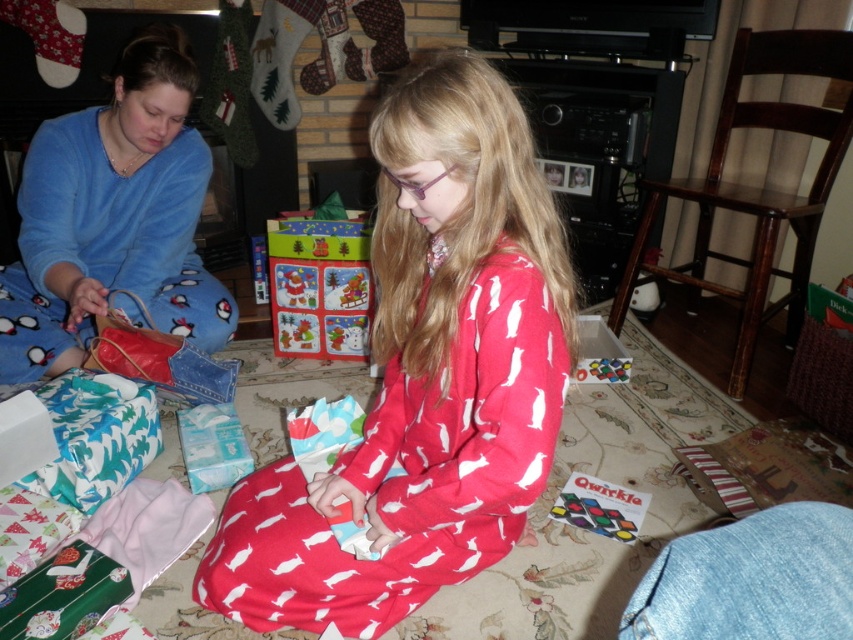
Question: Can you confirm if faded denim jacket at lower right is wider than christmas-themed paper gift at center?

Choices:
 (A) no
 (B) yes

Answer: (A)

Question: Which object appears farthest from the camera in this image?

Choices:
 (A) faded denim jacket at lower right
 (B) blue fleece pajamas at left

Answer: (B)

Question: In this image, where is red flannel pajamas at center located relative to blue fleece pajamas at left?

Choices:
 (A) left
 (B) right

Answer: (B)

Question: Which of the following is the closest to the observer?

Choices:
 (A) (83, 179)
 (B) (379, 454)
 (C) (732, 547)
 (D) (277, 269)

Answer: (C)

Question: Which point is closer to the camera taking this photo?

Choices:
 (A) (329, 209)
 (B) (444, 528)
 (C) (152, 65)

Answer: (B)

Question: Is red flannel pajamas at center bigger than christmas-themed paper gift at center?

Choices:
 (A) yes
 (B) no

Answer: (A)